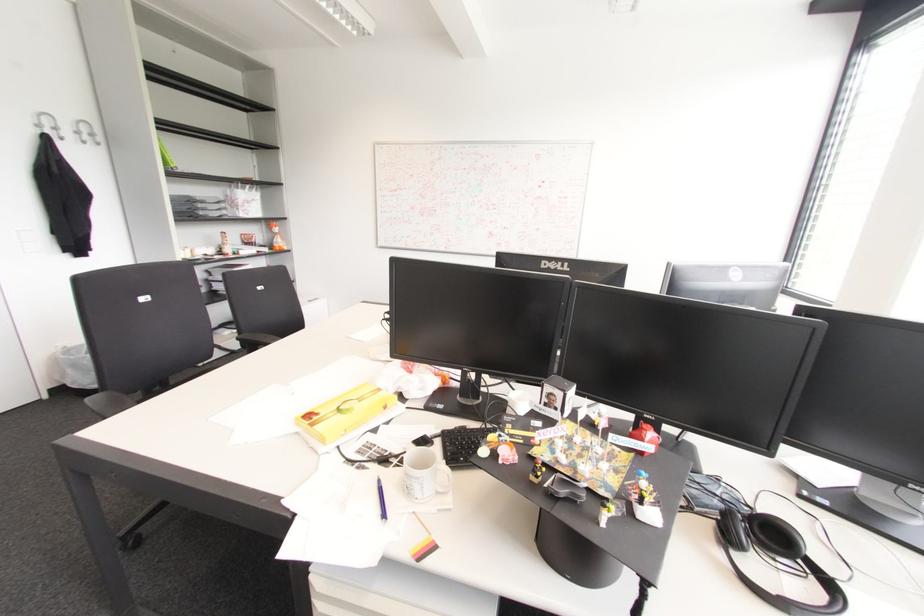
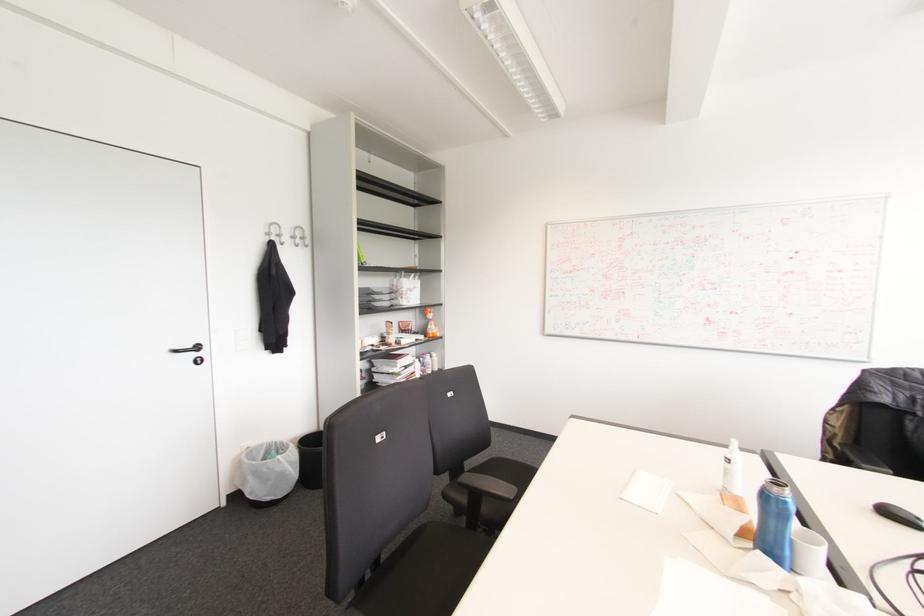
Question: The camera is either moving clockwise (left) or counter-clockwise (right) around the object. The first image is from the beginning of the video and the second image is from the end. Is the camera moving left or right when shooting the video?

Choices:
 (A) Left
 (B) Right

Answer: (B)